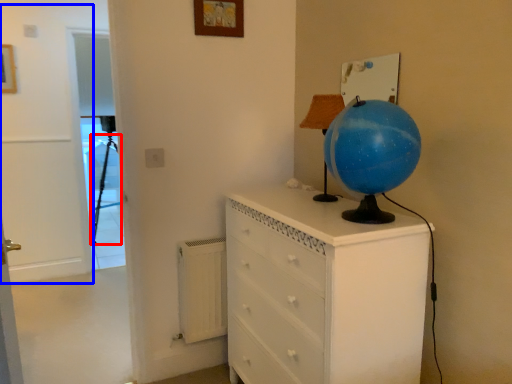
Question: Which of the following is the closest to the observer, tripod (highlighted by a red box) or door (highlighted by a blue box)?

Choices:
 (A) tripod
 (B) door

Answer: (B)